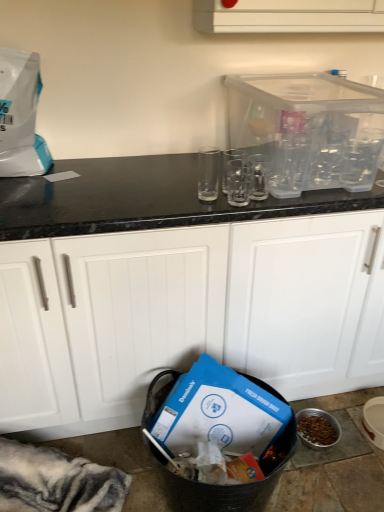
Where is `spots to the right of clear glass at center, which ranks as the 2th clear in left-to-right order`? This screenshot has width=384, height=512. spots to the right of clear glass at center, which ranks as the 2th clear in left-to-right order is located at coordinates (285, 205).